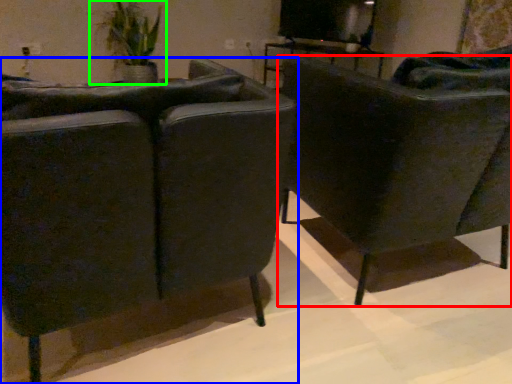
Question: Which is nearer to the chair (highlighted by a red box)? chair (highlighted by a blue box) or houseplant (highlighted by a green box).

Choices:
 (A) chair
 (B) houseplant

Answer: (A)